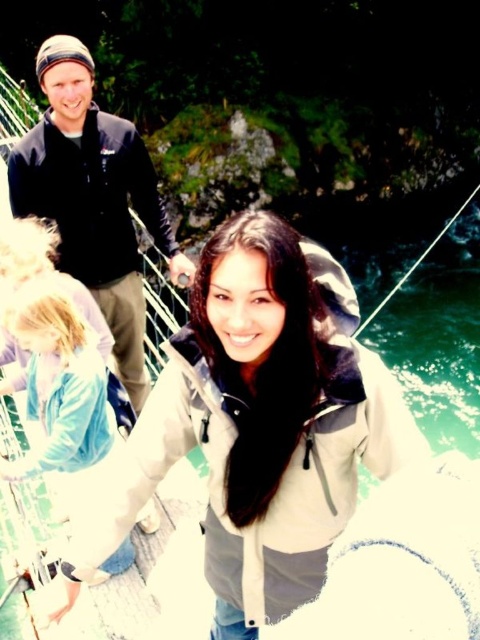
You are a photographer trying to capture both the black matte jacket at upper left and the light blue fabric jacket at lower left in a single shot. Can you adjust your position so that both jackets are equally in focus without moving the subjects?

The black matte jacket at upper left is further to the viewer than the light blue fabric jacket at lower left, so adjusting your position might not make both equally in focus since their distances differ. You may need to use a smaller aperture for a deeper depth of field to include both in focus.

You are trying to decide which jacket to wear for a hike. You know that the black matte jacket at upper left and the light blue fabric jacket at lower left are both available. If you want to choose the taller jacket, which one should you pick?

The light blue fabric jacket at lower left is taller than the black matte jacket at upper left, so you should choose the light blue fabric jacket at lower left if you want the taller one.

You are a photographer trying to capture the light gray softshell jacket at center in your shot. Based on the coordinates provided, where should you aim your camera? Please provide the coordinates in the format of a point like this example format, e.g., point at 0.667, 0.540.

The light gray softshell jacket at center is located at point at (259, 426).